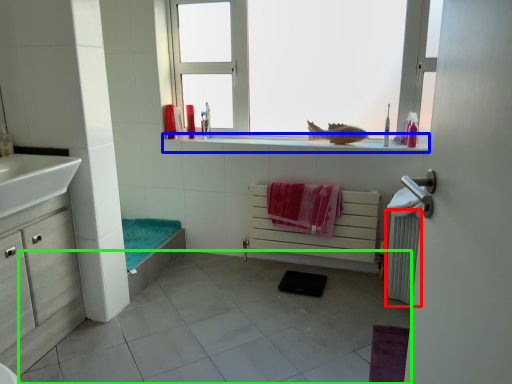
Question: Which is farther away from radiator (highlighted by a red box)? window sill (highlighted by a blue box) or tile (highlighted by a green box)?

Choices:
 (A) window sill
 (B) tile

Answer: (B)